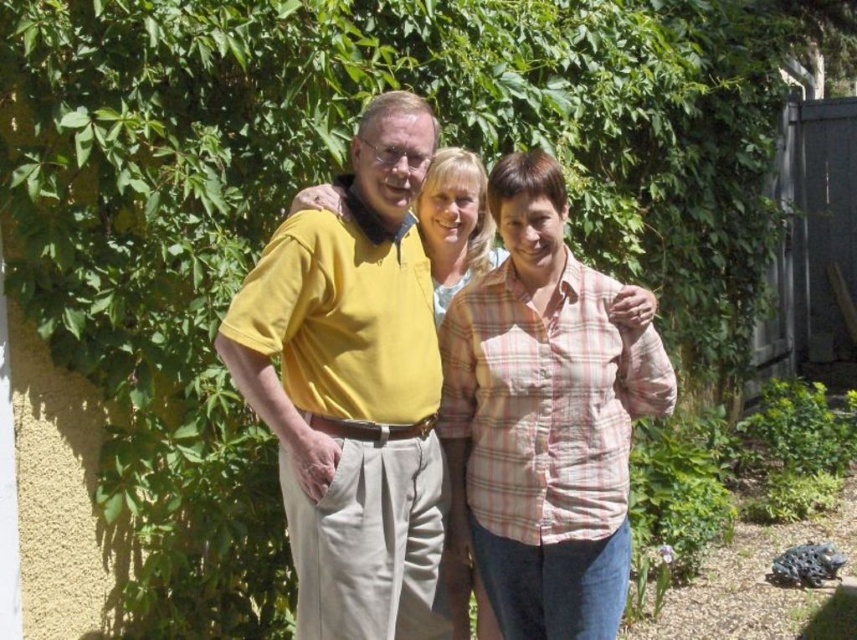
What do you see at coordinates (352, 388) in the screenshot? I see `yellow cotton shirt at center` at bounding box center [352, 388].

Identify the location of yellow cotton shirt at center. (352, 388).